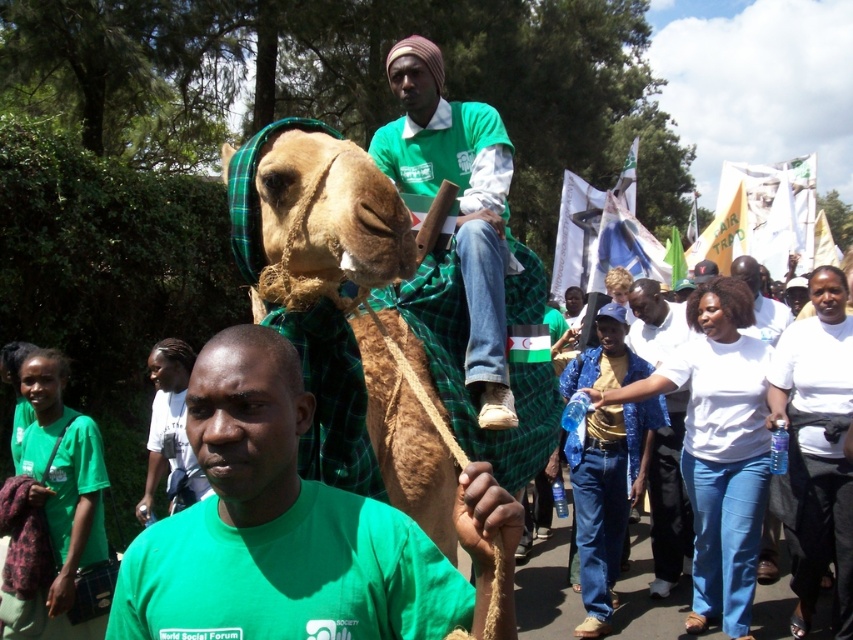
Question: Which object is farther from the camera taking this photo?

Choices:
 (A) green matte shirt at center
 (B) brown woolen camel at center
 (C) white cotton shirt at center

Answer: (C)

Question: Does green matte shirt at center have a lesser width compared to white cotton shirt at center?

Choices:
 (A) yes
 (B) no

Answer: (B)

Question: Which of the following is the closest to the observer?

Choices:
 (A) (508, 381)
 (B) (357, 179)
 (C) (662, 579)

Answer: (B)

Question: Where is brown woolen camel at center located in relation to green fabric cloth at center in the image?

Choices:
 (A) above
 (B) below

Answer: (B)

Question: Does green fabric cloth at center have a larger size compared to white cotton shirt at center?

Choices:
 (A) no
 (B) yes

Answer: (B)

Question: Based on their relative distances, which object is farther from the green fabric cloth at center?

Choices:
 (A) white cotton shirt at center
 (B) brown woolen camel at center
 (C) green matte shirt at center

Answer: (A)